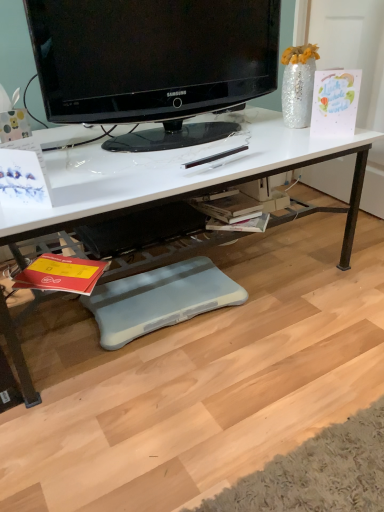
The image size is (384, 512). What do you see at coordinates (160, 298) in the screenshot? I see `blue foam footrest at lower center` at bounding box center [160, 298].

Identify the location of black glossy television at upper center. (153, 63).

Where is `blue foam footrest at lower center`? blue foam footrest at lower center is located at coordinates (160, 298).

Is blue foam footrest at lower center facing towards white glossy desk at center?

Yes, blue foam footrest at lower center is facing white glossy desk at center.

From the picture: Are blue foam footrest at lower center and white glossy desk at center far apart?

That's not correct — blue foam footrest at lower center is a little close to white glossy desk at center.

Who is shorter, blue foam footrest at lower center or white glossy desk at center?

blue foam footrest at lower center is shorter.

From a real-world perspective, which is physically above, blue foam footrest at lower center or white glossy desk at center?

white glossy desk at center.

From their relative heights in the image, would you say black glossy television at upper center is taller or shorter than blue foam footrest at lower center?

black glossy television at upper center is taller than blue foam footrest at lower center.

Is the surface of black glossy television at upper center in direct contact with blue foam footrest at lower center?

No, black glossy television at upper center is not in contact with blue foam footrest at lower center.

Considering the relative sizes of black glossy television at upper center and blue foam footrest at lower center in the image provided, is black glossy television at upper center bigger than blue foam footrest at lower center?

Yes, black glossy television at upper center is bigger than blue foam footrest at lower center.

Can you confirm if black glossy television at upper center is positioned to the right of blue foam footrest at lower center?

Correct, you'll find black glossy television at upper center to the right of blue foam footrest at lower center.

Is blue foam footrest at lower center not near black glossy television at upper center?

That's not correct — blue foam footrest at lower center is a little close to black glossy television at upper center.

Does blue foam footrest at lower center come behind black glossy television at upper center?

Yes, it is.

Considering the relative positions of blue foam footrest at lower center and black glossy television at upper center in the image provided, is blue foam footrest at lower center to the left of black glossy television at upper center from the viewer's perspective?

Indeed, blue foam footrest at lower center is positioned on the left side of black glossy television at upper center.

Is black glossy television at upper center completely or partially inside blue foam footrest at lower center?

Actually, black glossy television at upper center is outside blue foam footrest at lower center.

Looking at this image, from a real-world perspective, does white glossy desk at center sit lower than black glossy television at upper center?

Yes.

In terms of height, does white glossy desk at center look taller or shorter compared to black glossy television at upper center?

In the image, white glossy desk at center appears to be taller than black glossy television at upper center.

Is white glossy desk at center positioned with its back to black glossy television at upper center?

No, white glossy desk at center is not facing the opposite direction of black glossy television at upper center.

Which of these two, white glossy desk at center or black glossy television at upper center, is smaller?

Smaller between the two is black glossy television at upper center.

From a real-world perspective, relative to blue foam footrest at lower center, is white glossy desk at center vertically above or below?

white glossy desk at center is situated higher than blue foam footrest at lower center in the real world.

In the scene shown: Is white glossy desk at center further to the viewer compared to blue foam footrest at lower center?

No.

Considering the points (88, 197) and (162, 285), which point is in front, point (88, 197) or point (162, 285)?

The point (88, 197) is in front.

Which of these two, black glossy television at upper center or white glossy desk at center, is thinner?

Thinner between the two is black glossy television at upper center.

Considering the sizes of objects black glossy television at upper center and white glossy desk at center in the image provided, who is bigger, black glossy television at upper center or white glossy desk at center?

Bigger between the two is white glossy desk at center.

Consider the image. Is black glossy television at upper center with white glossy desk at center?

black glossy television at upper center and white glossy desk at center are clearly separated.

This screenshot has width=384, height=512. In order to click on desk that is on the left side of blue foam footrest at lower center in this screenshot , I will do `click(179, 176)`.

I want to click on footrest below the black glossy television at upper center (from the image's perspective), so [x=160, y=298].

When comparing their distances from blue foam footrest at lower center, does black glossy television at upper center or white glossy desk at center seem further?

Based on the image, black glossy television at upper center appears to be further to blue foam footrest at lower center.

From the image, which object appears to be nearer to black glossy television at upper center, white glossy desk at center or blue foam footrest at lower center?

white glossy desk at center.

Looking at the image, which one is located further to white glossy desk at center, blue foam footrest at lower center or black glossy television at upper center?

blue foam footrest at lower center.

Estimate the real-world distances between objects in this image. Which object is closer to black glossy television at upper center, blue foam footrest at lower center or white glossy desk at center?

white glossy desk at center is closer to black glossy television at upper center.

From the image, which object appears to be farther from blue foam footrest at lower center, white glossy desk at center or black glossy television at upper center?

black glossy television at upper center is positioned further to the anchor blue foam footrest at lower center.

Estimate the real-world distances between objects in this image. Which object is further from white glossy desk at center, black glossy television at upper center or blue foam footrest at lower center?

blue foam footrest at lower center.

This screenshot has width=384, height=512. Find the location of `desk between black glossy television at upper center and blue foam footrest at lower center vertically`. desk between black glossy television at upper center and blue foam footrest at lower center vertically is located at coordinates (179, 176).